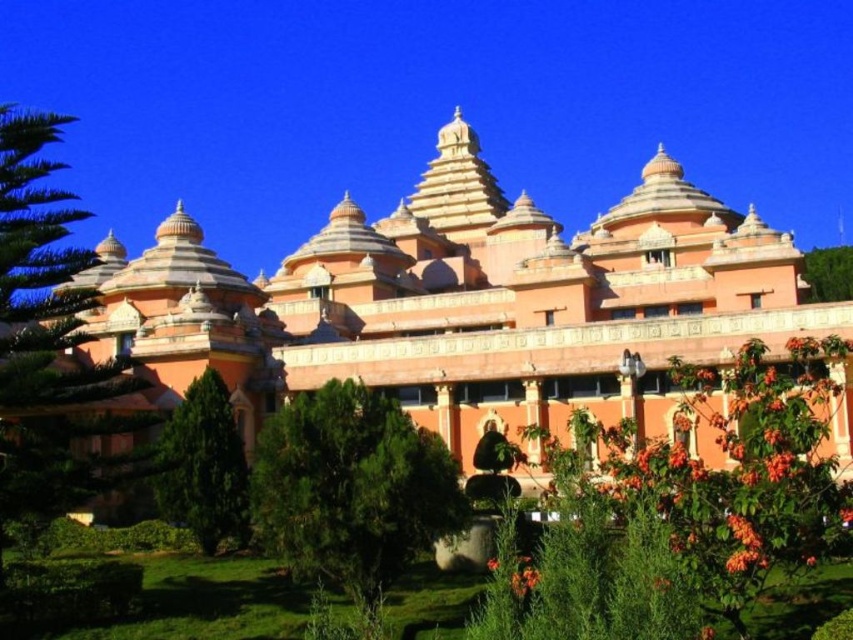
You are standing in front of the grand South Indian architectural structure. You see a point marked at coordinates [202,467]. What does this point indicate?

The point at coordinates [202,467] marks the location of the green leafy tree at lower left.

You are standing at the point marked as point (351, 486) in the image. What object is located exactly at this point?

The green leafy tree at center is located exactly at point (351, 486).

You are standing at the entrance of the grand South Indian architectural structure. You want to find the green leafy tree at lower left. Based on the coordinates provided, in which direction should you look to locate it?

The green leafy tree at lower left is located at coordinates point (202,467), which is towards the lower left direction from your current position at the entrance.